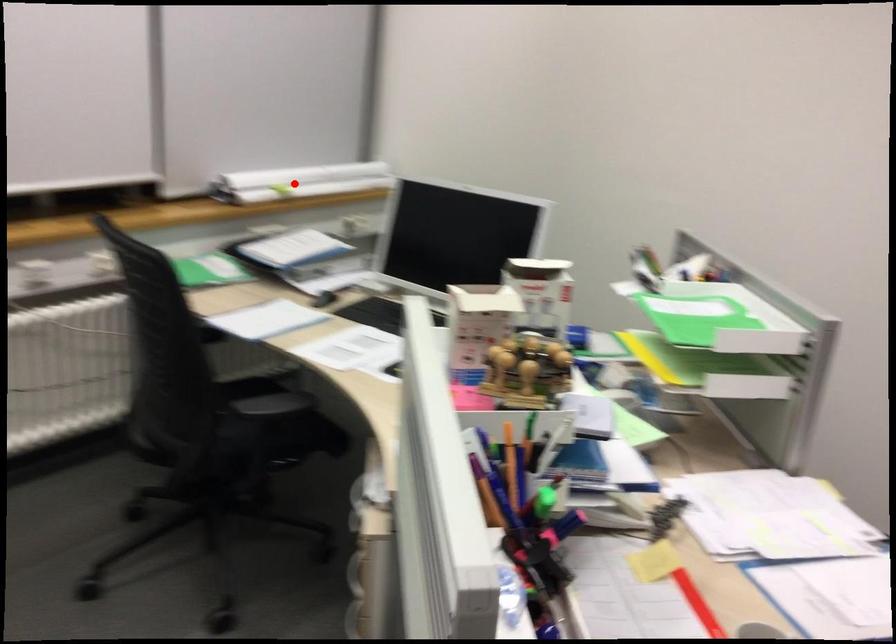
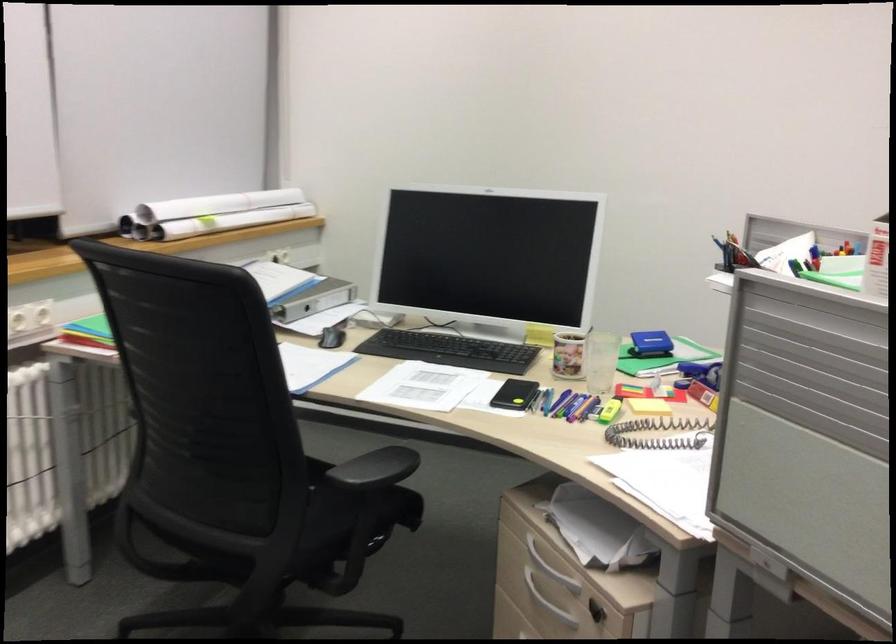
Question: I am providing you with two images of the same scene from different viewpoints. Image1 has a red point marked. In image2, the corresponding 3D location appears at what relative position? Reply with the corresponding letter.

Choices:
 (A) Closer
 (B) Farther

Answer: (A)